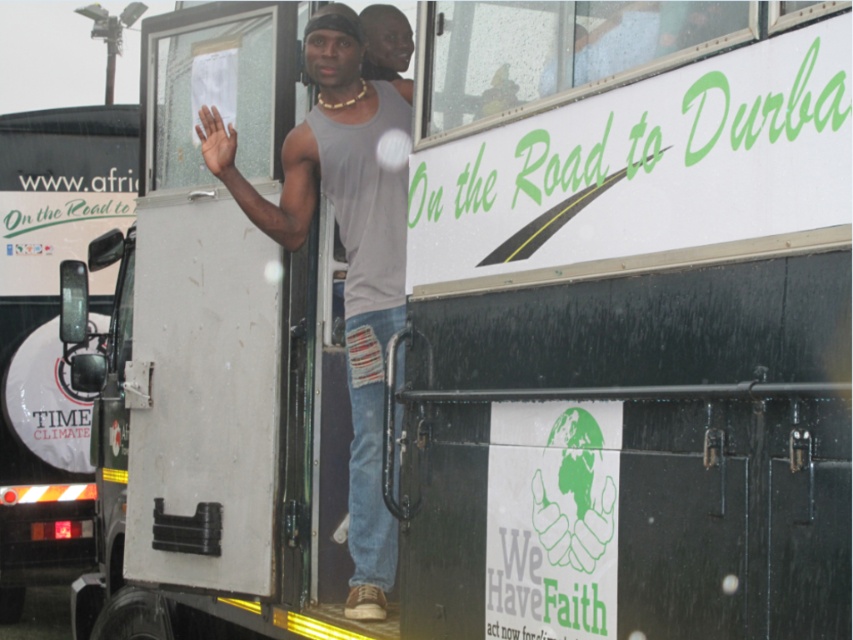
You are standing at the front of the truck and looking towards the cargo area. There are two points marked on the truck bed. Which point is closer to you, point (380, 24) or point (216, 109)?

Point (216, 109) is closer to you because it is in front of point (380, 24).

You are a photographer trying to capture the person in the truck. You need to focus on the point at coordinates point (x=386, y=45). Where exactly on the person should you aim your camera to ensure the focus is correct?

You should aim your camera at the matte gray tank top at center because the point (x=386, y=45) is located on that area.